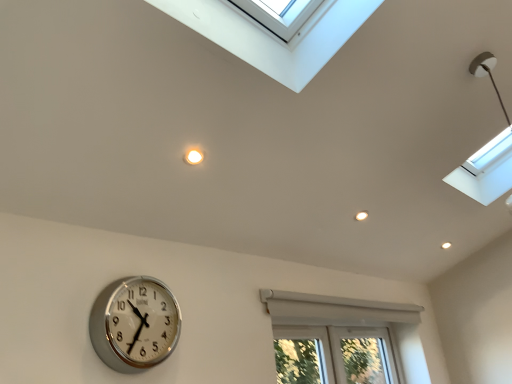
Question: From a real-world perspective, is white plastic window at lower center located beneath silver metallic clock at lower left?

Choices:
 (A) no
 (B) yes

Answer: (B)

Question: Can you confirm if white plastic window at lower center is shorter than silver metallic clock at lower left?

Choices:
 (A) no
 (B) yes

Answer: (A)

Question: Does white plastic window at lower center have a smaller size compared to silver metallic clock at lower left?

Choices:
 (A) yes
 (B) no

Answer: (B)

Question: From the image's perspective, is white plastic window at lower center located beneath silver metallic clock at lower left?

Choices:
 (A) yes
 (B) no

Answer: (A)

Question: Is white plastic window at lower center facing towards silver metallic clock at lower left?

Choices:
 (A) yes
 (B) no

Answer: (B)

Question: Is white plastic window at lower center looking in the opposite direction of silver metallic clock at lower left?

Choices:
 (A) no
 (B) yes

Answer: (A)

Question: From a real-world perspective, is silver metallic clock at lower left below white plastic window at lower center?

Choices:
 (A) yes
 (B) no

Answer: (B)

Question: From the image's perspective, is silver metallic clock at lower left under white plastic window at lower center?

Choices:
 (A) yes
 (B) no

Answer: (B)

Question: Does silver metallic clock at lower left turn towards white plastic window at lower center?

Choices:
 (A) no
 (B) yes

Answer: (A)

Question: Is silver metallic clock at lower left with white plastic window at lower center?

Choices:
 (A) no
 (B) yes

Answer: (A)

Question: Considering the relative sizes of silver metallic clock at lower left and white plastic window at lower center in the image provided, is silver metallic clock at lower left taller than white plastic window at lower center?

Choices:
 (A) yes
 (B) no

Answer: (B)

Question: Considering the relative positions of silver metallic clock at lower left and white plastic window at lower center in the image provided, is silver metallic clock at lower left in front of white plastic window at lower center?

Choices:
 (A) yes
 (B) no

Answer: (A)

Question: Is point tap(288, 372) positioned closer to the camera than point tap(112, 342)?

Choices:
 (A) closer
 (B) farther

Answer: (B)